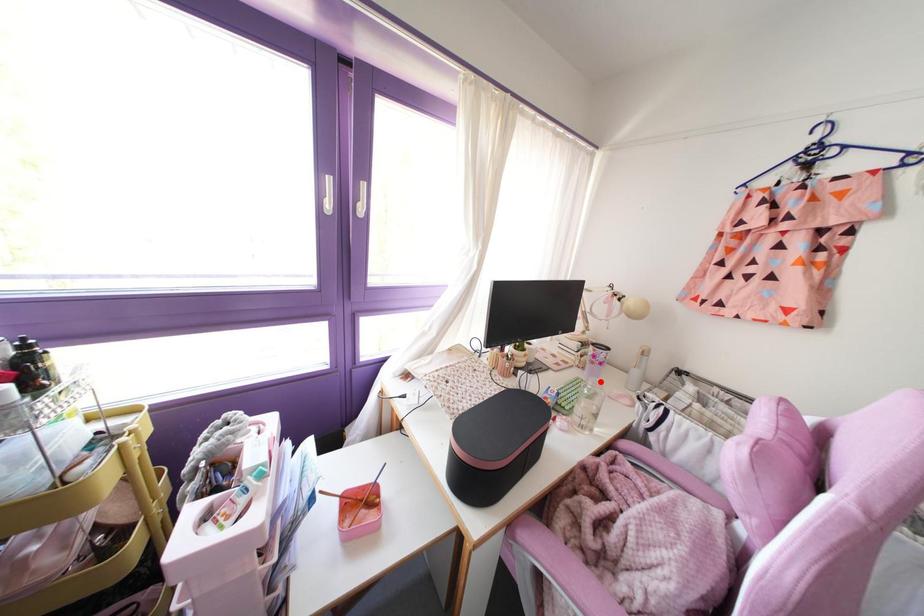
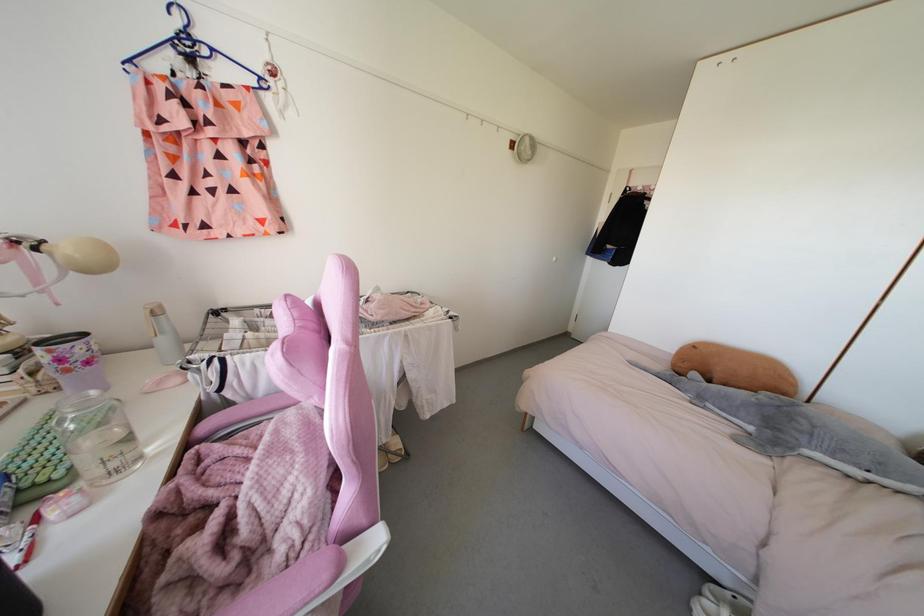
Find the pixel in the second image that matches the highlighted location in the first image.

(92, 392)